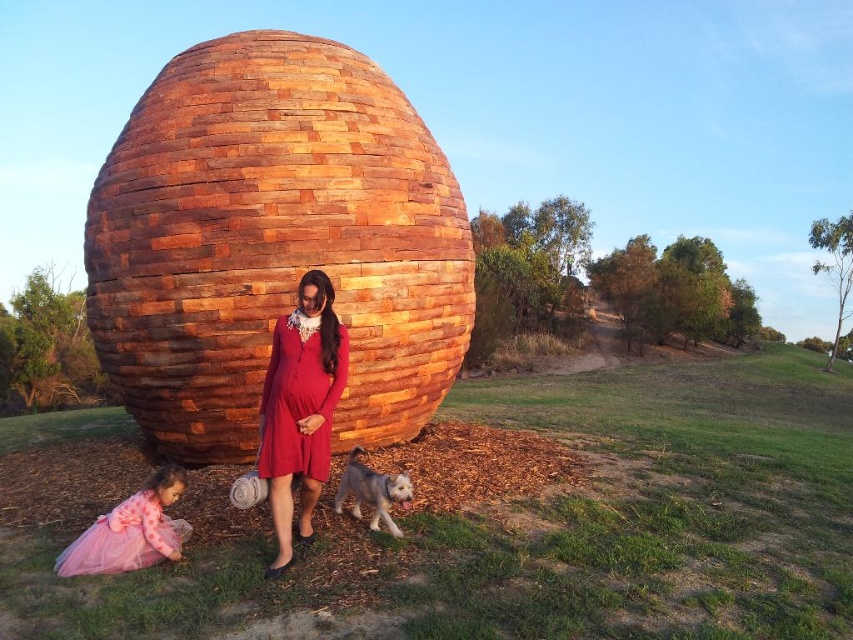
Which is above, matte red dress at center or pink tulle dress at lower left?

matte red dress at center is above.

Is matte red dress at center taller than pink tulle dress at lower left?

Yes, matte red dress at center is taller than pink tulle dress at lower left.

Is point (303, 356) closer to camera compared to point (76, 566)?

No, it is behind (76, 566).

Where is `matte red dress at center`? Image resolution: width=853 pixels, height=640 pixels. matte red dress at center is located at coordinates (300, 408).

Can you confirm if matte red dress at center is smaller than white-furred dog at lower center?

No.

Who is more forward, (329, 340) or (352, 509)?

Point (329, 340) is in front.

Locate an element on the screen. Image resolution: width=853 pixels, height=640 pixels. matte red dress at center is located at coordinates (300, 408).

Can you confirm if pink tulle dress at lower left is taller than white-furred dog at lower center?

Indeed, pink tulle dress at lower left has a greater height compared to white-furred dog at lower center.

Does pink tulle dress at lower left appear under white-furred dog at lower center?

Yes, pink tulle dress at lower left is below white-furred dog at lower center.

Who is more forward, (172, 502) or (358, 504)?

Positioned in front is point (172, 502).

Where is `pink tulle dress at lower left`? pink tulle dress at lower left is located at coordinates (131, 531).